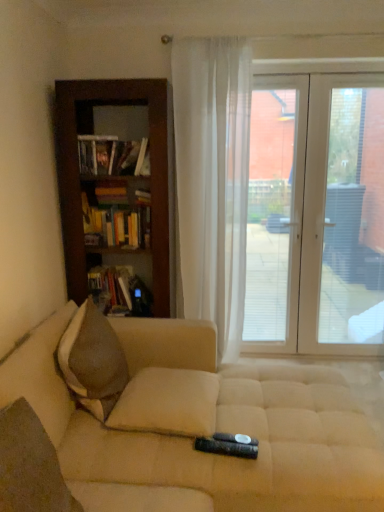
Question: Does wooden bookcase at left have a lesser height compared to brown textured pillow at left?

Choices:
 (A) no
 (B) yes

Answer: (A)

Question: Can you confirm if wooden bookcase at left is taller than brown textured pillow at left?

Choices:
 (A) yes
 (B) no

Answer: (A)

Question: Is brown textured pillow at left a part of wooden bookcase at left?

Choices:
 (A) no
 (B) yes

Answer: (A)

Question: Is wooden bookcase at left to the right of brown textured pillow at left from the viewer's perspective?

Choices:
 (A) no
 (B) yes

Answer: (B)

Question: Are wooden bookcase at left and brown textured pillow at left making contact?

Choices:
 (A) yes
 (B) no

Answer: (B)

Question: Is wooden bookcase at left positioned in front of brown textured pillow at left?

Choices:
 (A) yes
 (B) no

Answer: (B)

Question: From the image's perspective, does beige fabric couch at lower center appear lower than hardcover book at left, which ranks as the first book in top-to-bottom order?

Choices:
 (A) no
 (B) yes

Answer: (B)

Question: Is beige fabric couch at lower center facing away from hardcover book at left, which ranks as the first book in top-to-bottom order?

Choices:
 (A) yes
 (B) no

Answer: (B)

Question: Does beige fabric couch at lower center have a smaller size compared to hardcover book at left, which ranks as the first book in top-to-bottom order?

Choices:
 (A) yes
 (B) no

Answer: (B)

Question: Is beige fabric couch at lower center further to the viewer compared to hardcover book at left, which ranks as the first book in top-to-bottom order?

Choices:
 (A) no
 (B) yes

Answer: (A)

Question: Considering the relative sizes of beige fabric couch at lower center and hardcover book at left, which ranks as the first book in top-to-bottom order, in the image provided, is beige fabric couch at lower center shorter than hardcover book at left, which ranks as the first book in top-to-bottom order,?

Choices:
 (A) no
 (B) yes

Answer: (A)

Question: Is beige fabric couch at lower center at the left side of hardcover book at left, marked as the third book in a bottom-to-top arrangement?

Choices:
 (A) no
 (B) yes

Answer: (A)

Question: From a real-world perspective, is transparent plastic window screen at center, the second window screen from the right, under brown textured pillow at left?

Choices:
 (A) yes
 (B) no

Answer: (B)